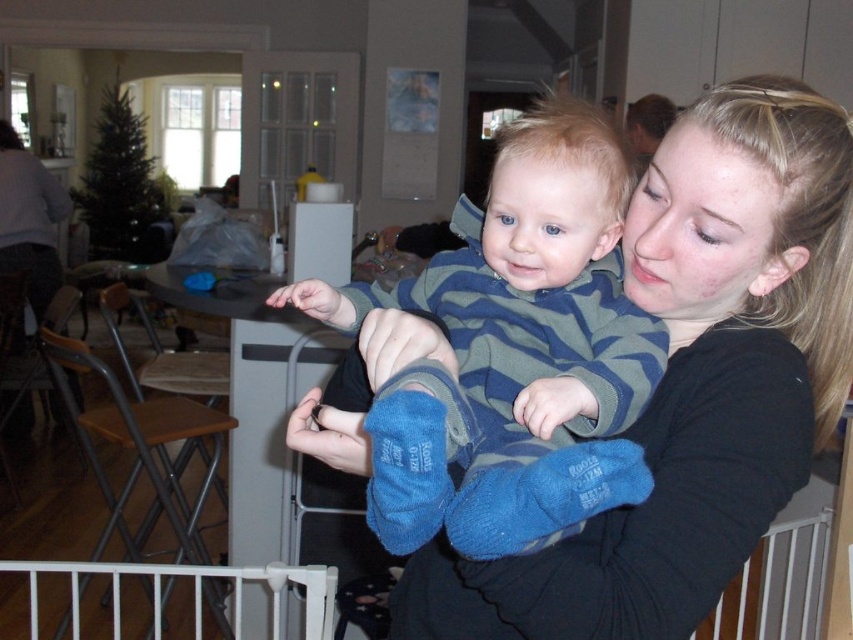
You are a parent who wants to ensure the baby can safely move between the white plastic rail at lower right and the white plastic gate at lower left. Given that the baby uses a walker that requires 1.2 meters of space to maneuver, can the baby safely move between these two objects?

The distance between the white plastic rail at lower right and the white plastic gate at lower left is 1.30 meters, which is slightly more than the 1.2 meters required by the baby walker. Therefore, the baby can safely move between them.

You are standing at the point with coordinates point (764,534) and want to walk towards the point with coordinates point (201,611). Given the scene described, will you pass in front of or behind the Christmas tree?

Since point (764,534) is in front of point (201,611), you would be walking towards the point (201,611) by moving away from the Christmas tree, so you would pass behind the Christmas tree.

In the scene shown: You are a photographer trying to capture the baby in the image. The baby is wearing blue fleece socks at center. If you want to focus your camera on the socks, what are the coordinates you should aim for?

The coordinates for the blue fleece socks at center are at point (x=514, y=353).